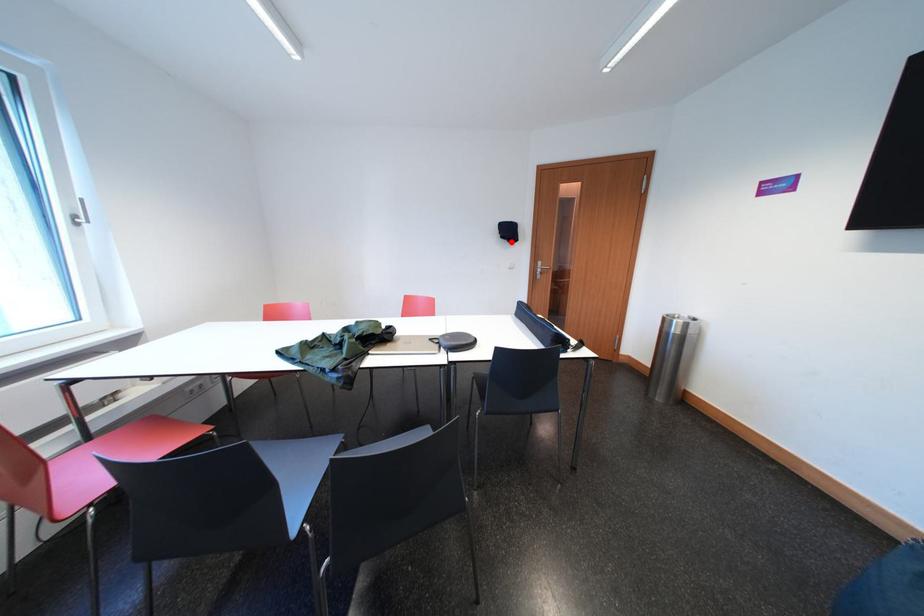
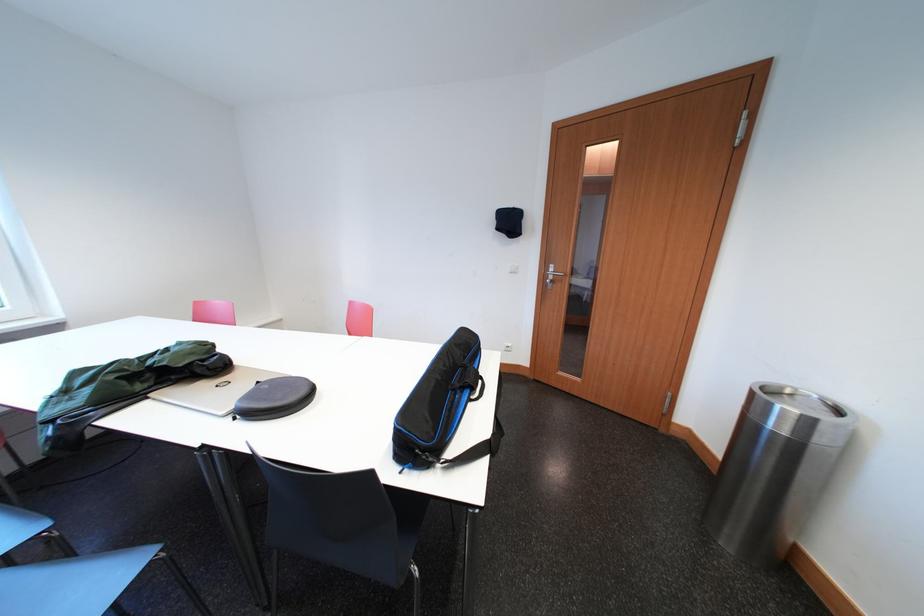
In the second image, find the point that corresponds to the highlighted location in the first image.

(506, 233)